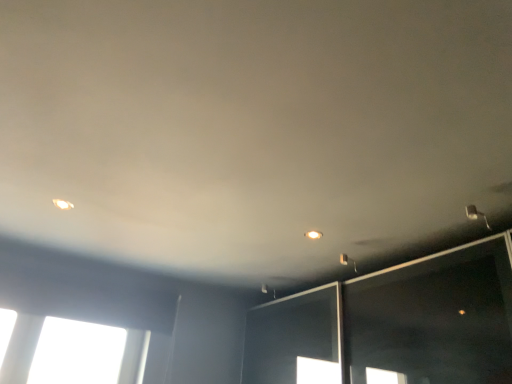
Question: Is matte white light fixture at upper right, the 1th dot from the right, bigger or smaller than matte white light fixture at upper right?

Choices:
 (A) big
 (B) small

Answer: (B)

Question: From the image's perspective, is matte white light fixture at upper right, the 1th dot from the right, positioned above or below matte white light fixture at upper right?

Choices:
 (A) below
 (B) above

Answer: (B)

Question: Estimate the real-world distances between objects in this image. Which object is closer to the matte white light fixture at upper right, the 1th dot from the right?

Choices:
 (A) matte white light fixture at upper left, marked as the second dot in a bottom-to-top arrangement
 (B) matte white light fixture at upper right

Answer: (B)

Question: Which object is the farthest from the matte white light fixture at upper right, the 1th dot positioned from the back?

Choices:
 (A) matte white light fixture at upper left, placed as the second dot when sorted from back to front
 (B) matte white light fixture at upper right

Answer: (A)